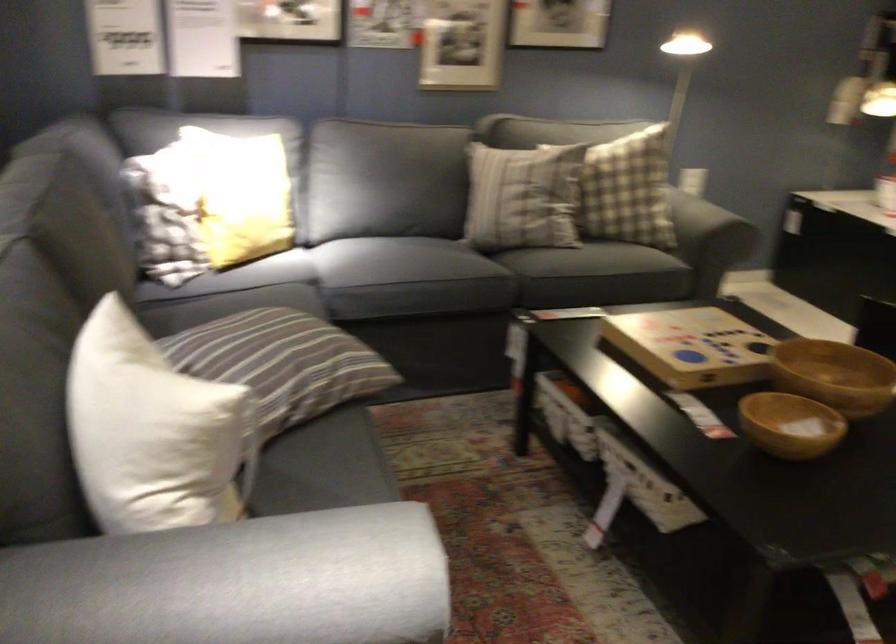
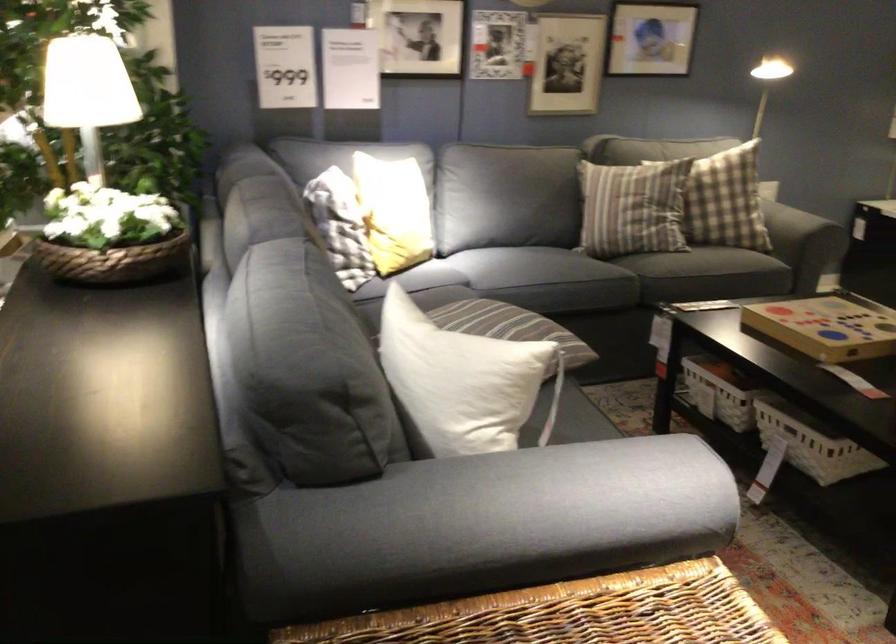
The point at (x=389, y=267) is marked in the first image. Where is the corresponding point in the second image?

(538, 267)